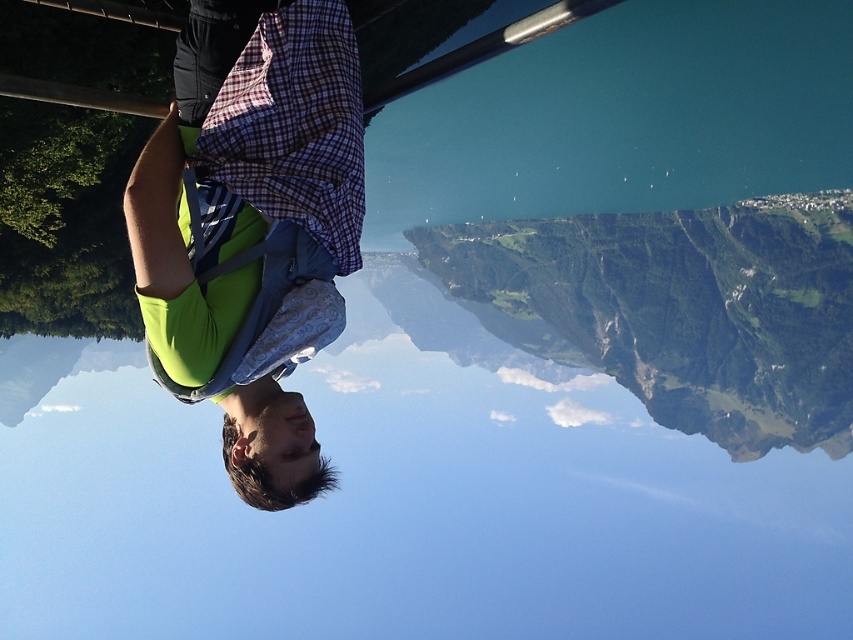
Question: Can you confirm if green fabric shirt at upper left is wider than green grassy mountain at upper right?

Choices:
 (A) no
 (B) yes

Answer: (A)

Question: Can you confirm if green fabric shirt at upper left is positioned below green grassy mountain at upper right?

Choices:
 (A) yes
 (B) no

Answer: (A)

Question: Can you confirm if green fabric shirt at upper left is thinner than green grassy mountain at upper right?

Choices:
 (A) yes
 (B) no

Answer: (A)